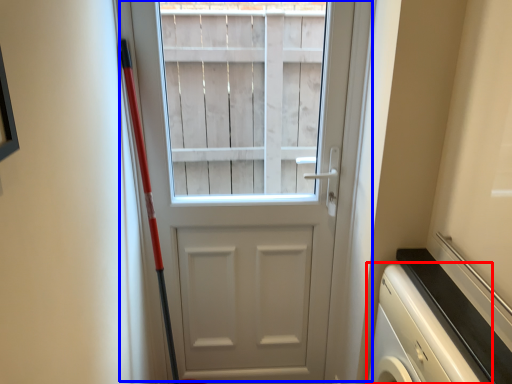
Question: Among these objects, which one is nearest to the camera, dish washer (highlighted by a red box) or door (highlighted by a blue box)?

Choices:
 (A) dish washer
 (B) door

Answer: (A)